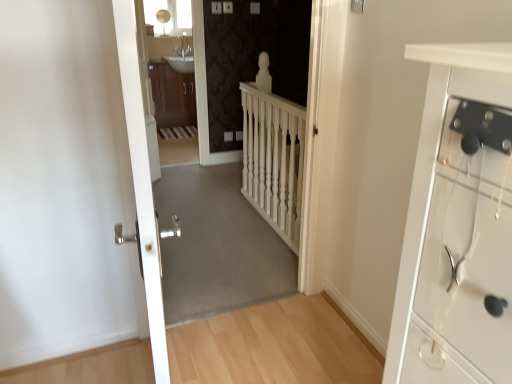
The height and width of the screenshot is (384, 512). Describe the element at coordinates (172, 96) in the screenshot. I see `wooden cabinet at center` at that location.

The image size is (512, 384). Describe the element at coordinates (159, 31) in the screenshot. I see `matte white sink at center, which is the second corridor in bottom-to-top order` at that location.

This screenshot has height=384, width=512. Find the location of `light wood floor at center`. light wood floor at center is located at coordinates (272, 346).

Locate an element on the screen. white plastic electric outlet at center is located at coordinates (228, 136).

Between white wooden balustrade at center and matte white sink at center, which is the second corridor in bottom-to-top order, which one appears on the left side from the viewer's perspective?

Positioned to the left is matte white sink at center, which is the second corridor in bottom-to-top order.

Is white wooden balustrade at center located outside matte white sink at center, the first corridor viewed from the top?

That's correct, white wooden balustrade at center is outside of matte white sink at center, the first corridor viewed from the top.

Who is shorter, white wooden balustrade at center or matte white sink at center, the first corridor viewed from the top?

Standing shorter between the two is white wooden balustrade at center.

Is white wooden balustrade at center positioned before matte white sink at center, which is the second corridor in bottom-to-top order?

Yes.

Which is more to the left, white plastic electric outlet at center or white wooden balustrade at center?

white plastic electric outlet at center is more to the left.

Can white wooden balustrade at center be found inside white plastic electric outlet at center?

No, white wooden balustrade at center is not inside white plastic electric outlet at center.

Consider the image. From a real-world perspective, is white plastic electric outlet at center physically located above or below white wooden balustrade at center?

white plastic electric outlet at center is situated lower than white wooden balustrade at center in the real world.

Considering the relative sizes of white plastic electric outlet at center and white wooden balustrade at center in the image provided, is white plastic electric outlet at center wider than white wooden balustrade at center?

In fact, white plastic electric outlet at center might be narrower than white wooden balustrade at center.

Which object is thinner, white plastic electric outlet at center or white textured stairwell at center?

Thinner between the two is white plastic electric outlet at center.

In the scene shown: From the image's perspective, who appears lower, white plastic electric outlet at center or white textured stairwell at center?

white plastic electric outlet at center is shown below in the image.

Would you say white plastic electric outlet at center is to the left or to the right of white textured stairwell at center in the picture?

Clearly, white plastic electric outlet at center is on the right of white textured stairwell at center in the image.

Can we say white plastic electric outlet at center lies outside white textured stairwell at center?

Yes, white plastic electric outlet at center is not within white textured stairwell at center.

Does point (178, 73) come behind point (247, 240)?

Yes, point (178, 73) is behind point (247, 240).

Between wooden cabinet at center and carpeted corridor at center, which is the 2th corridor from top to bottom, which one has less height?

carpeted corridor at center, which is the 2th corridor from top to bottom.

Considering the sizes of objects wooden cabinet at center and carpeted corridor at center, which is the 2th corridor from top to bottom, in the image provided, who is wider, wooden cabinet at center or carpeted corridor at center, which is the 2th corridor from top to bottom,?

Wider between the two is carpeted corridor at center, which is the 2th corridor from top to bottom.

Measure the distance between wooden cabinet at center and carpeted corridor at center, which ranks as the first corridor in bottom-to-top order.

2.55 meters.

Considering the relative sizes of white metallic door at center and white wooden balustrade at center in the image provided, is white metallic door at center wider than white wooden balustrade at center?

Correct, the width of white metallic door at center exceeds that of white wooden balustrade at center.

Is white metallic door at center in front of or behind white wooden balustrade at center in the image?

Clearly, white metallic door at center is in front of white wooden balustrade at center.

The image size is (512, 384). What are the coordinates of `balustrade located above the white metallic door at center (from the image's perspective)` in the screenshot? It's located at (273, 154).

In the scene shown: Is white metallic door at center completely or partially outside of white wooden balustrade at center?

Absolutely, white metallic door at center is external to white wooden balustrade at center.

Is matte white sink at center, which is the second corridor in bottom-to-top order, bigger than white plastic electric outlet at center?

Correct, matte white sink at center, which is the second corridor in bottom-to-top order, is larger in size than white plastic electric outlet at center.

Is matte white sink at center, the first corridor viewed from the top, positioned in front of white plastic electric outlet at center?

Yes, the depth of matte white sink at center, the first corridor viewed from the top, is less than that of white plastic electric outlet at center.

Can you confirm if matte white sink at center, the first corridor viewed from the top, is positioned to the left of white plastic electric outlet at center?

Indeed, matte white sink at center, the first corridor viewed from the top, is positioned on the left side of white plastic electric outlet at center.

From the image's perspective, between matte white sink at center, which is the second corridor in bottom-to-top order, and white plastic electric outlet at center, who is located below?

From the image's view, white plastic electric outlet at center is below.

From the image's perspective, is white textured stairwell at center beneath wooden cabinet at center?

Yes, from the image's perspective, white textured stairwell at center is below wooden cabinet at center.

From a real-world perspective, is white textured stairwell at center physically located above or below wooden cabinet at center?

In terms of real-world spatial position, white textured stairwell at center is below wooden cabinet at center.

Is white textured stairwell at center to the left or to the right of wooden cabinet at center in the image?

white textured stairwell at center is positioned on wooden cabinet at center's right side.

Where is `corridor above the white wooden balustrade at center (from a real-world perspective)`? The image size is (512, 384). corridor above the white wooden balustrade at center (from a real-world perspective) is located at coordinates (159, 31).

I want to click on balustrade that is below the white plastic electric outlet at center (from the image's perspective), so click(x=273, y=154).

From the image, which object appears to be nearer to carpeted corridor at center, which ranks as the first corridor in bottom-to-top order, white wooden balustrade at center or white metallic door at center?

The object closer to carpeted corridor at center, which ranks as the first corridor in bottom-to-top order, is white wooden balustrade at center.

From the image, which object appears to be nearer to wooden cabinet at center, white wooden balustrade at center or carpeted corridor at center, which is the 2th corridor from top to bottom?

carpeted corridor at center, which is the 2th corridor from top to bottom.

In the scene shown: Which object lies further to the anchor point white metallic door at center, matte white sink at center, the first corridor viewed from the top, or white wooden balustrade at center?

Based on the image, white wooden balustrade at center appears to be further to white metallic door at center.

Considering their positions, is white wooden balustrade at center positioned further to white plastic electric outlet at center than wooden cabinet at center?

wooden cabinet at center is positioned further to the anchor white plastic electric outlet at center.

Based on their spatial positions, is carpeted corridor at center, which is the 2th corridor from top to bottom, or light wood floor at center closer to white metallic door at center?

light wood floor at center is positioned closer to the anchor white metallic door at center.

Based on the photo, which object lies further to the anchor point white plastic electric outlet at center, light wood floor at center or matte white sink at center, the first corridor viewed from the top?

light wood floor at center is positioned further to the anchor white plastic electric outlet at center.

When comparing their distances from white plastic electric outlet at center, does white wooden balustrade at center or matte white sink at center, the first corridor viewed from the top, seem further?

matte white sink at center, the first corridor viewed from the top, lies further to white plastic electric outlet at center than the other object.

Which object lies nearer to the anchor point white wooden balustrade at center, white plastic electric outlet at center or carpeted corridor at center, which ranks as the first corridor in bottom-to-top order?

carpeted corridor at center, which ranks as the first corridor in bottom-to-top order, lies closer to white wooden balustrade at center than the other object.

The width and height of the screenshot is (512, 384). Find the location of `corridor located between carpeted corridor at center, which is the 2th corridor from top to bottom, and white textured stairwell at center in the depth direction`. corridor located between carpeted corridor at center, which is the 2th corridor from top to bottom, and white textured stairwell at center in the depth direction is located at coordinates (159, 31).

Locate an element on the screen. This screenshot has height=384, width=512. path located between white metallic door at center and white wooden balustrade at center in the depth direction is located at coordinates (272, 346).

Where is `balustrade between white metallic door at center and white textured stairwell at center from front to back`? balustrade between white metallic door at center and white textured stairwell at center from front to back is located at coordinates (273, 154).

This screenshot has width=512, height=384. What are the coordinates of `balustrade positioned between light wood floor at center and matte white sink at center, which is the second corridor in bottom-to-top order, from near to far` in the screenshot? It's located at (273, 154).